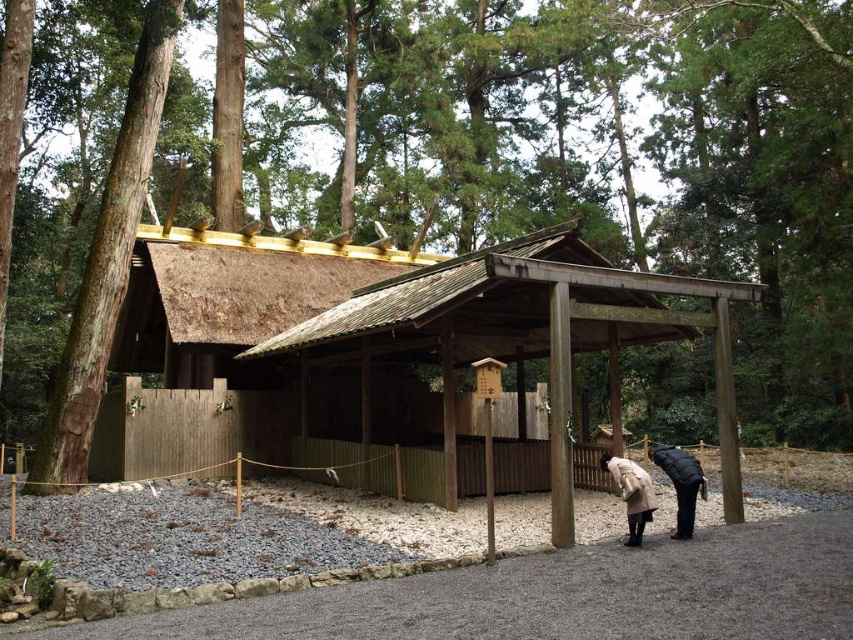
Question: Among these objects, which one is farthest from the camera?

Choices:
 (A) beige wool coat at lower center
 (B) black matte coat at lower right

Answer: (B)

Question: Does black matte coat at lower right have a larger size compared to beige wool coat at lower center?

Choices:
 (A) yes
 (B) no

Answer: (A)

Question: Which point is farther from the camera taking this photo?

Choices:
 (A) (645, 512)
 (B) (697, 484)

Answer: (B)

Question: Where is black matte coat at lower right located in relation to beige wool coat at lower center in the image?

Choices:
 (A) above
 (B) below

Answer: (B)

Question: Does black matte coat at lower right have a greater width compared to beige wool coat at lower center?

Choices:
 (A) yes
 (B) no

Answer: (A)